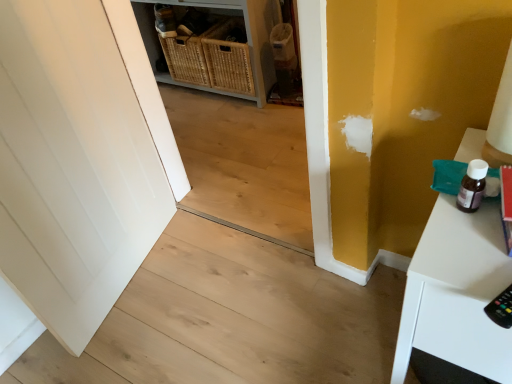
Question: Is woven wicker baskets at center positioned far away from natural wood stair at center?

Choices:
 (A) no
 (B) yes

Answer: (B)

Question: Does woven wicker baskets at center appear on the left side of natural wood stair at center?

Choices:
 (A) no
 (B) yes

Answer: (B)

Question: From a real-world perspective, is woven wicker baskets at center positioned under natural wood stair at center based on gravity?

Choices:
 (A) yes
 (B) no

Answer: (B)

Question: Is woven wicker baskets at center outside natural wood stair at center?

Choices:
 (A) no
 (B) yes

Answer: (B)

Question: From the image's perspective, does woven wicker baskets at center appear higher than natural wood stair at center?

Choices:
 (A) yes
 (B) no

Answer: (A)

Question: In terms of width, does woven wicker baskets at center look wider or thinner when compared to white glossy table at right?

Choices:
 (A) wide
 (B) thin

Answer: (B)

Question: Is woven wicker baskets at center bigger or smaller than white glossy table at right?

Choices:
 (A) big
 (B) small

Answer: (A)

Question: Is point (264, 8) positioned closer to the camera than point (468, 332)?

Choices:
 (A) farther
 (B) closer

Answer: (A)

Question: Do you think woven wicker baskets at center is within white glossy table at right, or outside of it?

Choices:
 (A) inside
 (B) outside

Answer: (B)

Question: Considering their positions, is natural wood stair at center located in front of or behind woven wicker baskets at center?

Choices:
 (A) front
 (B) behind

Answer: (A)

Question: Looking at their shapes, would you say natural wood stair at center is wider or thinner than woven wicker baskets at center?

Choices:
 (A) thin
 (B) wide

Answer: (B)

Question: In terms of height, does natural wood stair at center look taller or shorter compared to woven wicker baskets at center?

Choices:
 (A) short
 (B) tall

Answer: (A)

Question: Is point (241, 311) closer or farther from the camera than point (250, 46)?

Choices:
 (A) closer
 (B) farther

Answer: (A)

Question: From the image's perspective, relative to white glossy table at right, is natural wood stair at center above or below?

Choices:
 (A) below
 (B) above

Answer: (A)

Question: Based on their positions, is natural wood stair at center located to the left or right of white glossy table at right?

Choices:
 (A) right
 (B) left

Answer: (B)